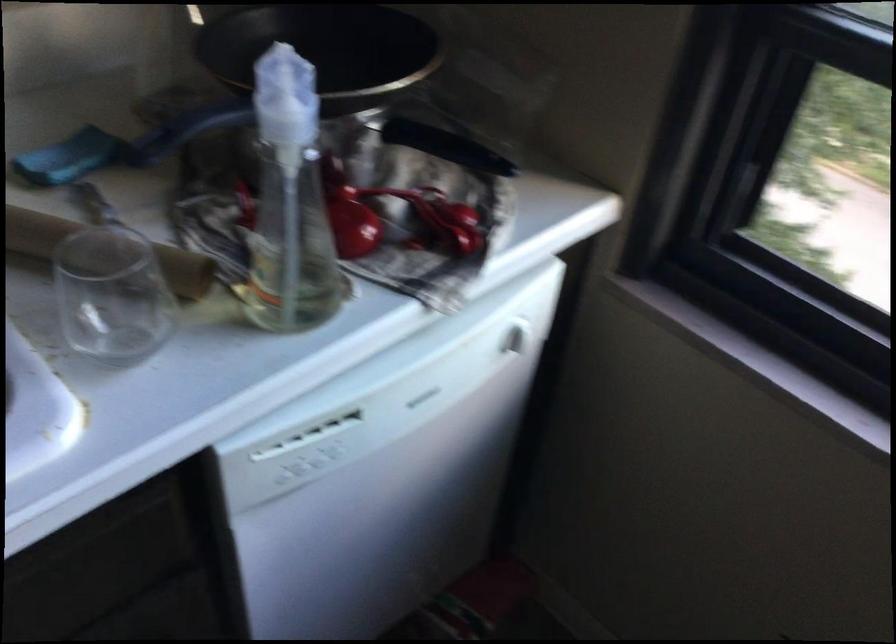
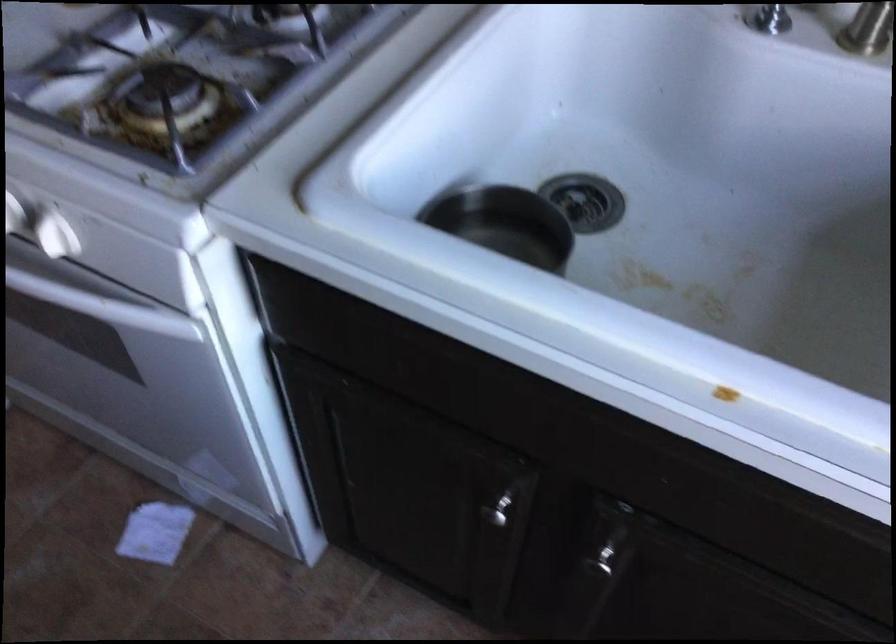
First-person continuous shooting, in which direction is the camera rotating?

The rotation direction of the camera is left-down.